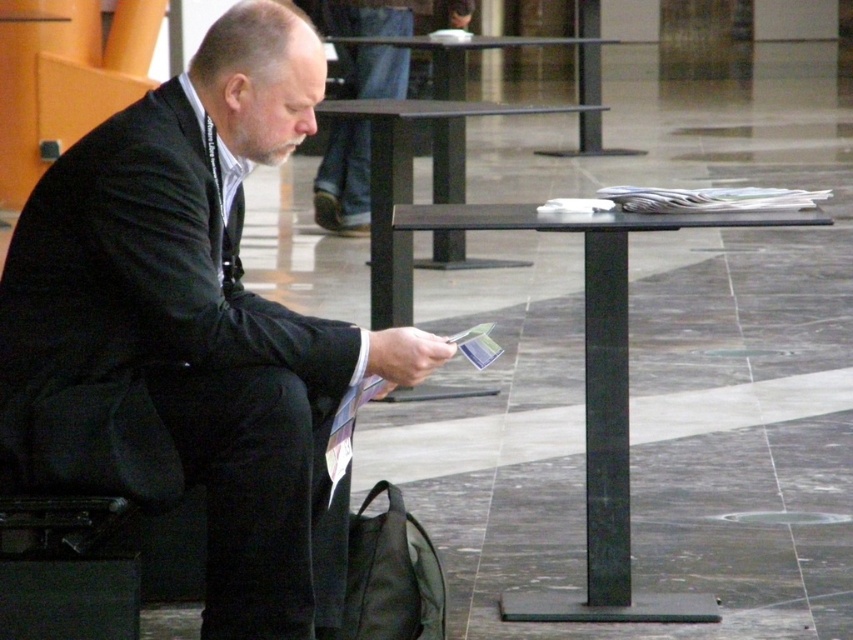
You are a photographer standing in the lobby and want to take a photo of the matte black suit at center and the black metal table at center. Which object should you focus on first if you want to capture both in a single shot without moving the camera?

The matte black suit at center is taller than the black metal table at center, so you should focus on the matte black suit at center first to ensure both are in frame.

Where is the black glass table at center located in the image?

The black glass table at center is located at the point with coordinates 0.295 in the x axis and 0.484 in the y axis.

You are a person who just entered the lobby and see the black glass table at center and the black fabric bag at lower left. Which object is closer to you?

The black fabric bag at lower left is closer to you because it is positioned under the black glass table at center, which is above it.